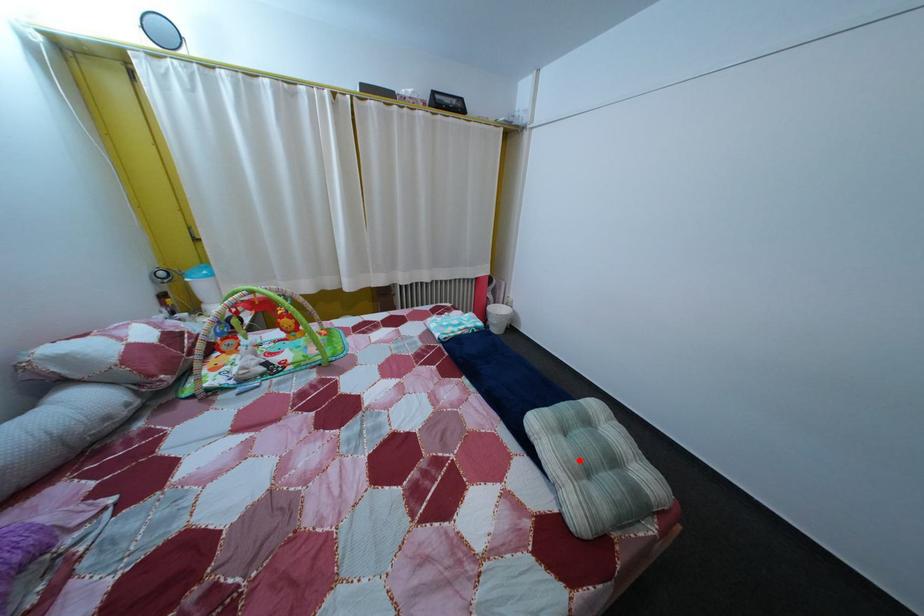
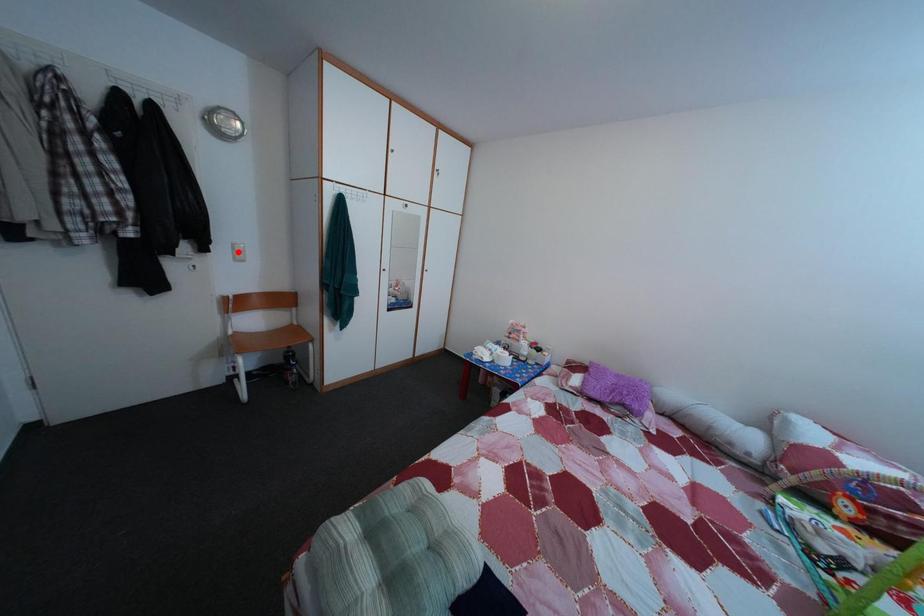
Consider the image. I am providing you with two images of the same scene from different viewpoints. A red point is marked on the first image and another point is marked on the second image. Is the marked point in image1 the same physical position as the marked point in image2?

No